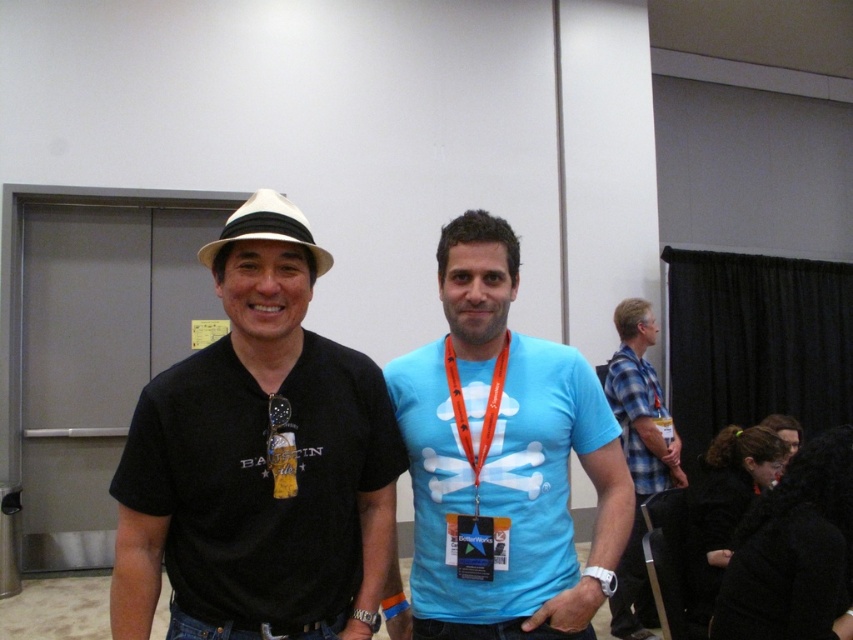
Question: Is black matte neck at center thinner than orange lanyard at center?

Choices:
 (A) yes
 (B) no

Answer: (B)

Question: Can you confirm if black matte hat at left is thinner than black matte neck at center?

Choices:
 (A) yes
 (B) no

Answer: (B)

Question: Which is nearer to the gold metallic medal at center?

Choices:
 (A) blue matte t-shirt at center
 (B) blue plaid shirt at right

Answer: (A)

Question: Which object is farther from the camera taking this photo?

Choices:
 (A) gold metallic medal at center
 (B) orange lanyard at center
 (C) blue matte t-shirt at center

Answer: (B)

Question: Which object appears closest to the camera in this image?

Choices:
 (A) blue matte t-shirt at center
 (B) gold metallic medal at center
 (C) white matte cowboy hat at upper center

Answer: (C)

Question: Does blue plaid shirt at right have a larger size compared to white matte cowboy hat at upper center?

Choices:
 (A) no
 (B) yes

Answer: (B)